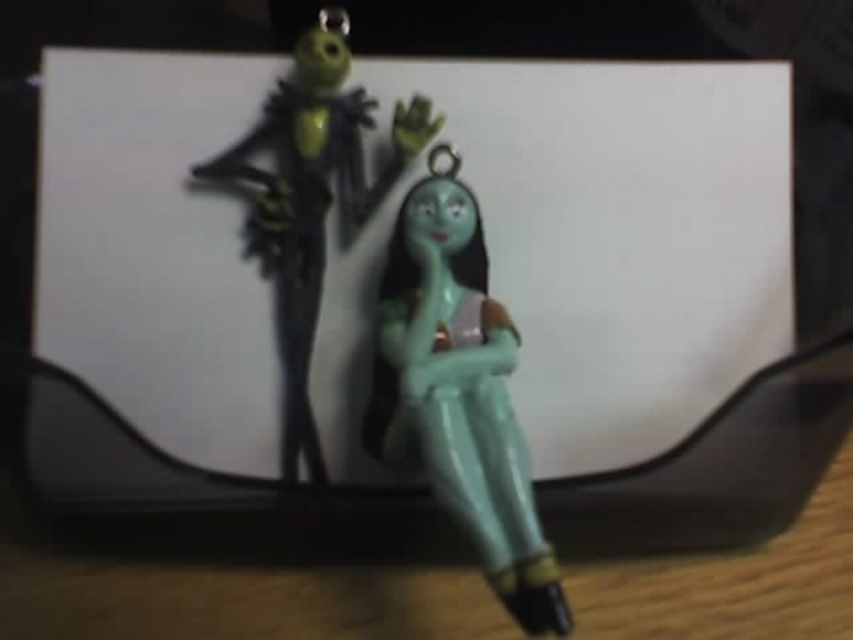
Find the location of a particular element. The width and height of the screenshot is (853, 640). teal glossy figure at center is located at coordinates (457, 392).

Between teal glossy figure at center and matte green figure at center, which one appears on the right side from the viewer's perspective?

From the viewer's perspective, teal glossy figure at center appears more on the right side.

Identify the location of teal glossy figure at center. This screenshot has height=640, width=853. (457, 392).

The image size is (853, 640). What are the coordinates of `teal glossy figure at center` in the screenshot? It's located at [x=457, y=392].